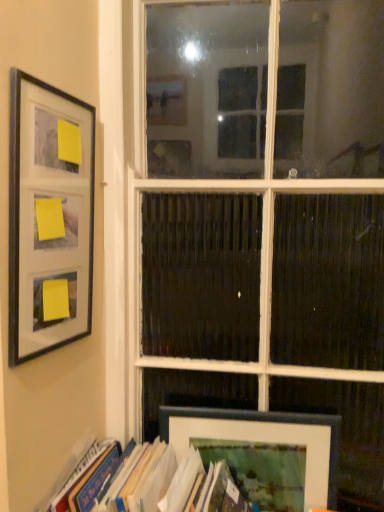
What do you see at coordinates (263, 452) in the screenshot?
I see `matte black frame at lower right, which is the first picture frame from right to left` at bounding box center [263, 452].

Measure the distance between white glass window at center and camera.

white glass window at center and camera are 37.33 inches apart.

I want to click on matte black frame at lower right, marked as the second picture frame in a left-to-right arrangement, so click(x=263, y=452).

Considering the positions of point (45, 291) and point (179, 448), is point (45, 291) closer or farther from the camera than point (179, 448)?

Point (45, 291).

From the image's perspective, which is below, matte black frame at left, the 2th picture frame ordered from the bottom, or matte black frame at lower right, marked as the second picture frame in a left-to-right arrangement?

matte black frame at lower right, marked as the second picture frame in a left-to-right arrangement.

In order to click on picture frame that is above the matte black frame at lower right, arranged as the 1th picture frame when ordered from the bottom (from the image's perspective) in this screenshot , I will do `click(49, 217)`.

From a real-world perspective, is matte black frame at lower right, arranged as the 1th picture frame when ordered from the bottom, below hardcover book at lower left?

No, from a real-world perspective, matte black frame at lower right, arranged as the 1th picture frame when ordered from the bottom, is not beneath hardcover book at lower left.

How distant is matte black frame at lower right, which is counted as the second picture frame, starting from the top, from hardcover book at lower left?

They are 4.80 inches apart.

Does matte black frame at lower right, marked as the second picture frame in a left-to-right arrangement, have a smaller size compared to hardcover book at lower left?

Yes, matte black frame at lower right, marked as the second picture frame in a left-to-right arrangement, is smaller than hardcover book at lower left.

Considering the sizes of objects matte black frame at lower right, arranged as the 2th picture frame when viewed from the front, and hardcover book at lower left in the image provided, who is thinner, matte black frame at lower right, arranged as the 2th picture frame when viewed from the front, or hardcover book at lower left?

Thinner between the two is matte black frame at lower right, arranged as the 2th picture frame when viewed from the front.

Consider the image. Considering their positions, is hardcover book at lower left located in front of or behind matte black frame at lower right, which is counted as the second picture frame, starting from the top?

Clearly, hardcover book at lower left is in front of matte black frame at lower right, which is counted as the second picture frame, starting from the top.

From the image's perspective, is hardcover book at lower left above or below matte black frame at lower right, arranged as the 2th picture frame when viewed from the front?

Based on their image positions, hardcover book at lower left is located beneath matte black frame at lower right, arranged as the 2th picture frame when viewed from the front.

Is point (150, 490) behind point (333, 438)?

That is False.

This screenshot has height=512, width=384. I want to click on picture frame in front of the matte black frame at lower right, which is counted as the second picture frame, starting from the top, so click(49, 217).

Is point (264, 443) more distant than point (85, 142)?

Yes, point (264, 443) is farther from viewer.

Who is shorter, matte black frame at lower right, arranged as the 2th picture frame when viewed from the front, or matte black frame at left, marked as the second picture frame in a right-to-left arrangement?

Standing shorter between the two is matte black frame at lower right, arranged as the 2th picture frame when viewed from the front.

Who is smaller, matte black frame at lower right, which is the 1th picture frame from back to front, or matte black frame at left, positioned as the first picture frame in top-to-bottom order?

Smaller between the two is matte black frame at lower right, which is the 1th picture frame from back to front.

Is point (354, 350) behind point (321, 443)?

Yes, it is behind point (321, 443).

Is matte black frame at lower right, marked as the second picture frame in a left-to-right arrangement, a part of white glass window at center?

Yes, matte black frame at lower right, marked as the second picture frame in a left-to-right arrangement, can be found within white glass window at center.

Based on their positions, is white glass window at center located to the left or right of matte black frame at lower right, arranged as the 2th picture frame when viewed from the front?

In the image, white glass window at center appears on the right side of matte black frame at lower right, arranged as the 2th picture frame when viewed from the front.

Considering the sizes of white glass window at center and matte black frame at lower right, which is the first picture frame from right to left, in the image, is white glass window at center wider or thinner than matte black frame at lower right, which is the first picture frame from right to left,?

white glass window at center is wider than matte black frame at lower right, which is the first picture frame from right to left.

Locate an element on the screen. The image size is (384, 512). window above the matte black frame at lower right, which is counted as the second picture frame, starting from the top (from a real-world perspective) is located at coordinates (262, 231).

Can you confirm if matte black frame at lower right, which is the 1th picture frame from back to front, is shorter than white glass window at center?

Yes.

Consider the image. From the image's perspective, between matte black frame at lower right, marked as the second picture frame in a left-to-right arrangement, and white glass window at center, who is located below?

matte black frame at lower right, marked as the second picture frame in a left-to-right arrangement, appears lower in the image.

Does point (331, 459) appear closer or farther from the camera than point (324, 380)?

Point (331, 459) is positioned closer to the camera compared to point (324, 380).

Is hardcover book at lower left looking in the opposite direction of white glass window at center?

Yes, hardcover book at lower left is facing away from white glass window at center.

Would you say hardcover book at lower left is inside or outside white glass window at center?

hardcover book at lower left cannot be found inside white glass window at center.

Looking at their sizes, would you say hardcover book at lower left is wider or thinner than white glass window at center?

Clearly, hardcover book at lower left has more width compared to white glass window at center.

Image resolution: width=384 pixels, height=512 pixels. Identify the location of book below the white glass window at center (from the image's perspective). (170, 484).

Locate an element on the screen. picture frame directly beneath the matte black frame at left, the second picture frame positioned from the back (from a real-world perspective) is located at coordinates (263, 452).

I want to click on the 1st picture frame positioned above the hardcover book at lower left (from a real-world perspective), so click(263, 452).

Based on their spatial positions, is matte black frame at left, positioned as the first picture frame in top-to-bottom order, or hardcover book at lower left closer to white glass window at center?

hardcover book at lower left.

Estimate the real-world distances between objects in this image. Which object is further from matte black frame at left, the 2th picture frame ordered from the bottom, hardcover book at lower left or white glass window at center?

hardcover book at lower left lies further to matte black frame at left, the 2th picture frame ordered from the bottom, than the other object.

From the image, which object appears to be farther from white glass window at center, matte black frame at lower right, which is counted as the second picture frame, starting from the top, or hardcover book at lower left?

The object further to white glass window at center is hardcover book at lower left.

Estimate the real-world distances between objects in this image. Which object is closer to white glass window at center, matte black frame at left, the 2th picture frame ordered from the bottom, or matte black frame at lower right, which is the 1th picture frame from back to front?

The object closer to white glass window at center is matte black frame at lower right, which is the 1th picture frame from back to front.

Based on their spatial positions, is matte black frame at left, marked as the second picture frame in a right-to-left arrangement, or matte black frame at lower right, which is the first picture frame from right to left, further from hardcover book at lower left?

matte black frame at left, marked as the second picture frame in a right-to-left arrangement, is positioned further to the anchor hardcover book at lower left.

Based on their spatial positions, is matte black frame at lower right, arranged as the 1th picture frame when ordered from the bottom, or hardcover book at lower left closer to matte black frame at left, placed as the first picture frame when sorted from front to back?

Based on the image, hardcover book at lower left appears to be nearer to matte black frame at left, placed as the first picture frame when sorted from front to back.

Based on their spatial positions, is matte black frame at lower right, arranged as the 1th picture frame when ordered from the bottom, or white glass window at center further from hardcover book at lower left?

Among the two, white glass window at center is located further to hardcover book at lower left.

Based on their spatial positions, is hardcover book at lower left or matte black frame at left, the second picture frame positioned from the back, closer to matte black frame at lower right, marked as the second picture frame in a left-to-right arrangement?

The object closer to matte black frame at lower right, marked as the second picture frame in a left-to-right arrangement, is hardcover book at lower left.

The image size is (384, 512). Identify the location of picture frame between matte black frame at left, marked as the second picture frame in a right-to-left arrangement, and hardcover book at lower left vertically. (263, 452).

Find the location of a particular element. The height and width of the screenshot is (512, 384). window between matte black frame at left, placed as the first picture frame when sorted from front to back, and hardcover book at lower left vertically is located at coordinates (262, 231).

Locate an element on the screen. window between matte black frame at left, the 2th picture frame ordered from the bottom, and matte black frame at lower right, which is counted as the second picture frame, starting from the top, from top to bottom is located at coordinates (262, 231).

Locate an element on the screen. This screenshot has height=512, width=384. picture frame between white glass window at center and hardcover book at lower left in the vertical direction is located at coordinates (263, 452).